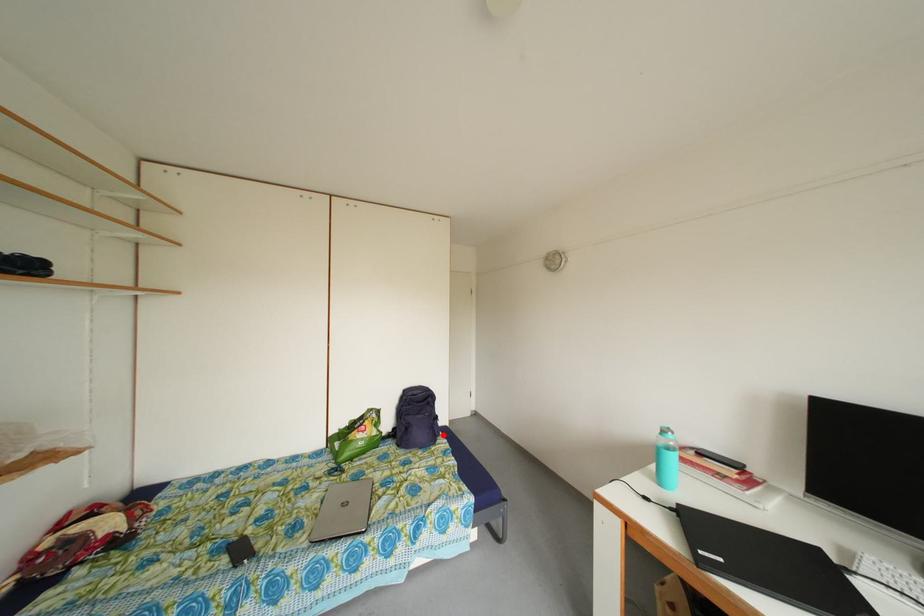
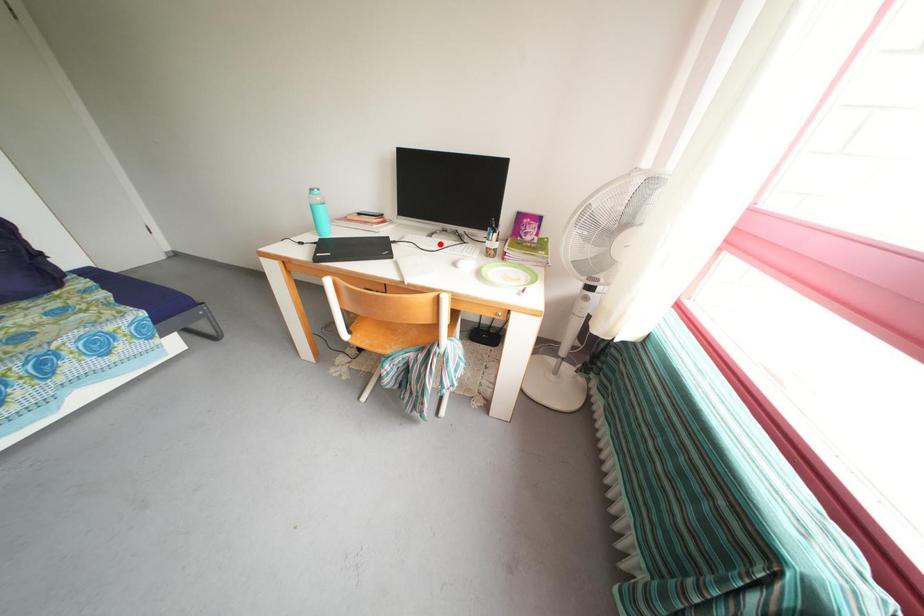
I am providing you with two images of the same scene from different viewpoints. A red point is marked on the first image and another point is marked on the second image. Does the point marked in image1 correspond to the same location as the one in image2?

No